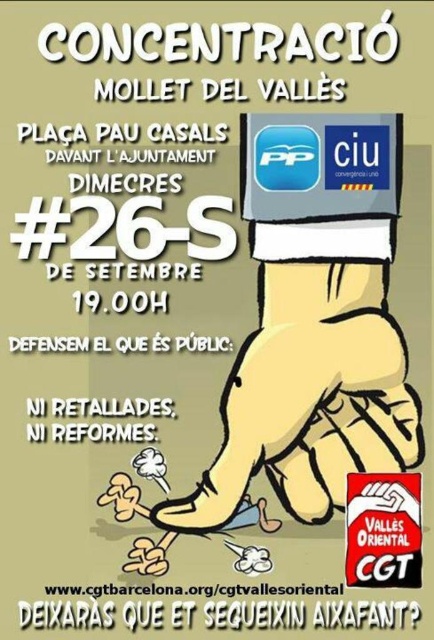
Question: Is yellow cartoon hand at center thinner than red rubber stamp at lower right?

Choices:
 (A) no
 (B) yes

Answer: (A)

Question: Is yellow cartoon hand at center further to the viewer compared to red rubber stamp at lower right?

Choices:
 (A) no
 (B) yes

Answer: (B)

Question: Can you confirm if yellow cartoon hand at center is thinner than red rubber stamp at lower right?

Choices:
 (A) yes
 (B) no

Answer: (B)

Question: Which object appears closest to the camera in this image?

Choices:
 (A) yellow cartoon hand at center
 (B) red rubber stamp at lower right

Answer: (B)

Question: Which point is closer to the camera?

Choices:
 (A) (359, 534)
 (B) (191, 506)

Answer: (A)